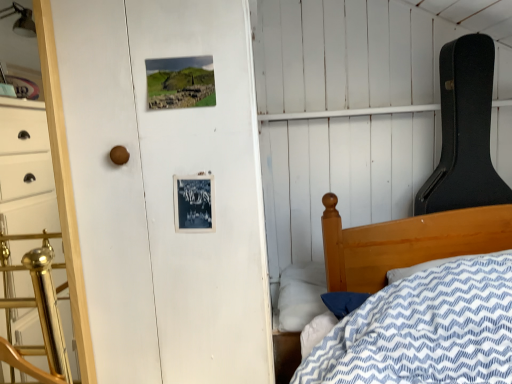
Question: Is white soft pillow at lower center oriented away from brushed brass dresser at left?

Choices:
 (A) yes
 (B) no

Answer: (B)

Question: Is white soft pillow at lower center further to the viewer compared to brushed brass dresser at left?

Choices:
 (A) no
 (B) yes

Answer: (B)

Question: Does white soft pillow at lower center have a greater width compared to brushed brass dresser at left?

Choices:
 (A) no
 (B) yes

Answer: (B)

Question: From the image's perspective, is white soft pillow at lower center on brushed brass dresser at left?

Choices:
 (A) yes
 (B) no

Answer: (B)

Question: Is white soft pillow at lower center taller than brushed brass dresser at left?

Choices:
 (A) yes
 (B) no

Answer: (B)

Question: Is white soft pillow at lower center thinner than brushed brass dresser at left?

Choices:
 (A) no
 (B) yes

Answer: (A)

Question: From the image's perspective, would you say brushed brass dresser at left is positioned over white soft pillow at lower center?

Choices:
 (A) no
 (B) yes

Answer: (B)

Question: From the image's perspective, does brushed brass dresser at left appear lower than white soft pillow at lower center?

Choices:
 (A) yes
 (B) no

Answer: (B)

Question: Is brushed brass dresser at left positioned far away from white soft pillow at lower center?

Choices:
 (A) no
 (B) yes

Answer: (A)

Question: Is brushed brass dresser at left taller than white soft pillow at lower center?

Choices:
 (A) no
 (B) yes

Answer: (B)

Question: Can you confirm if brushed brass dresser at left is thinner than white soft pillow at lower center?

Choices:
 (A) no
 (B) yes

Answer: (B)

Question: Is brushed brass dresser at left shorter than white soft pillow at lower center?

Choices:
 (A) yes
 (B) no

Answer: (B)

Question: Based on their sizes in the image, would you say white soft pillow at lower center is bigger or smaller than brushed brass dresser at left?

Choices:
 (A) small
 (B) big

Answer: (B)